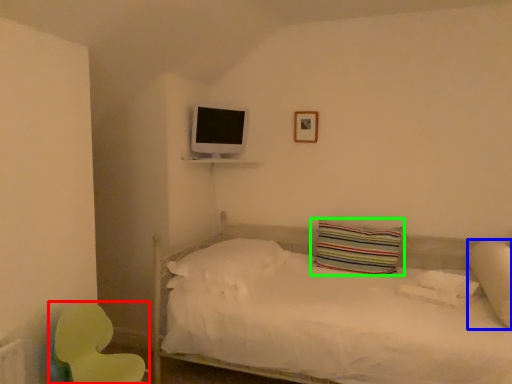
Question: Which object is the closest to the swivel chair (highlighted by a red box)? Choose among these: pillow (highlighted by a blue box) or pillow (highlighted by a green box).

Choices:
 (A) pillow
 (B) pillow

Answer: (B)